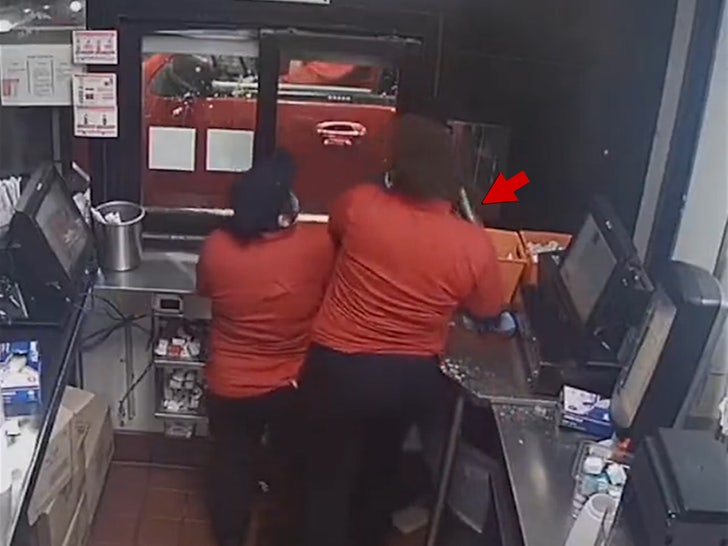
At what (x,y) coordinates should I click in order to perform the action: click on wires. Please return your answer as a coordinate pair (x, y). The width and height of the screenshot is (728, 546). Looking at the image, I should click on coord(119,318).